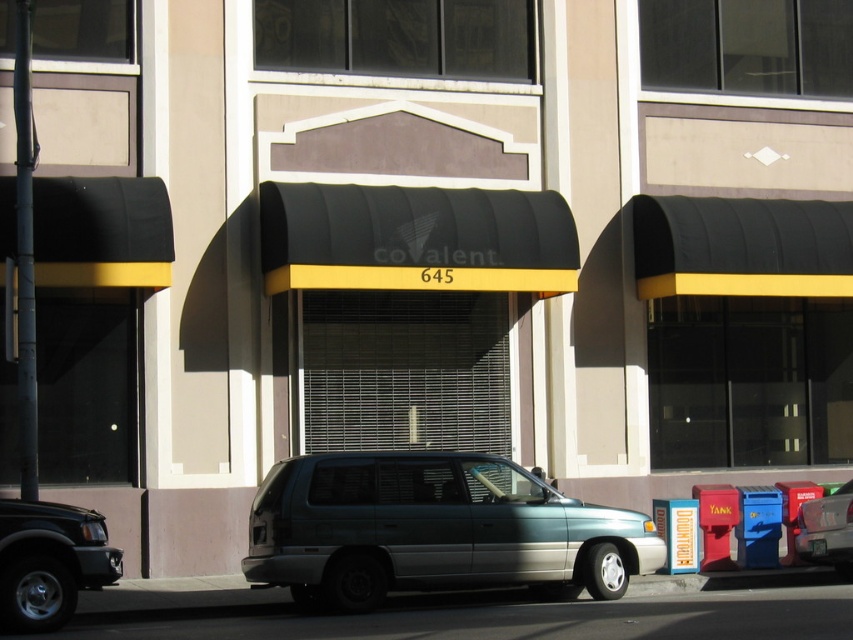
You are a delivery driver who needs to park your truck between the teal matte minivan at center and the matte black suv at lower left. Your truck requires a 10 feet space to park safely. Is there enough space between them?

The teal matte minivan at center and the matte black suv at lower left are 8.64 feet apart from each other, which is less than the required 10 feet for safe parking. Therefore, there is not enough space between them for the truck to park safely.

You are standing at the entrance of the building with the black awning that says covalent 645. You need to park your teal matte minivan. Where should you position it so that it is centered exactly at point (433, 531)?

You should position your teal matte minivan at the coordinates (433, 531) to center it exactly at that point.

You are a delivery driver who needs to park your truck between the matte black suv at lower left and the metallic silver minivan at center. Your truck is 6 meters long. Can you fit your truck between them without overlapping either vehicle?

The matte black suv at lower left is 7.76 meters from the metallic silver minivan at center. Since your truck is 6 meters long, there is enough space between them to park without overlapping either vehicle.